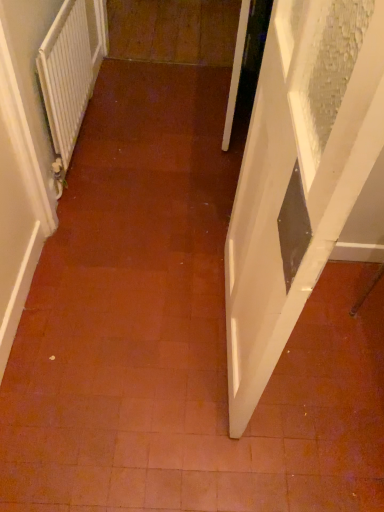
Question: Can you confirm if white textured radiator at left is taller than white glossy door at right?

Choices:
 (A) no
 (B) yes

Answer: (A)

Question: From a real-world perspective, is white textured radiator at left over white glossy door at right?

Choices:
 (A) no
 (B) yes

Answer: (A)

Question: Is white textured radiator at left aimed at white glossy door at right?

Choices:
 (A) yes
 (B) no

Answer: (B)

Question: Is white textured radiator at left thinner than white glossy door at right?

Choices:
 (A) yes
 (B) no

Answer: (A)

Question: Does white textured radiator at left have a smaller size compared to white glossy door at right?

Choices:
 (A) no
 (B) yes

Answer: (B)

Question: Is white textured radiator at left behind white glossy door at right?

Choices:
 (A) yes
 (B) no

Answer: (A)

Question: Are white glossy door at right and white textured radiator at left making contact?

Choices:
 (A) yes
 (B) no

Answer: (B)

Question: From the image's perspective, would you say white glossy door at right is shown under white textured radiator at left?

Choices:
 (A) no
 (B) yes

Answer: (B)

Question: Can you confirm if white glossy door at right is positioned to the right of white textured radiator at left?

Choices:
 (A) no
 (B) yes

Answer: (B)

Question: Does white glossy door at right have a lesser height compared to white textured radiator at left?

Choices:
 (A) yes
 (B) no

Answer: (B)

Question: From a real-world perspective, is white glossy door at right over white textured radiator at left?

Choices:
 (A) yes
 (B) no

Answer: (A)

Question: Is white glossy door at right oriented away from white textured radiator at left?

Choices:
 (A) no
 (B) yes

Answer: (A)

Question: From the image's perspective, is white glossy door at right located above or below white textured radiator at left?

Choices:
 (A) above
 (B) below

Answer: (B)